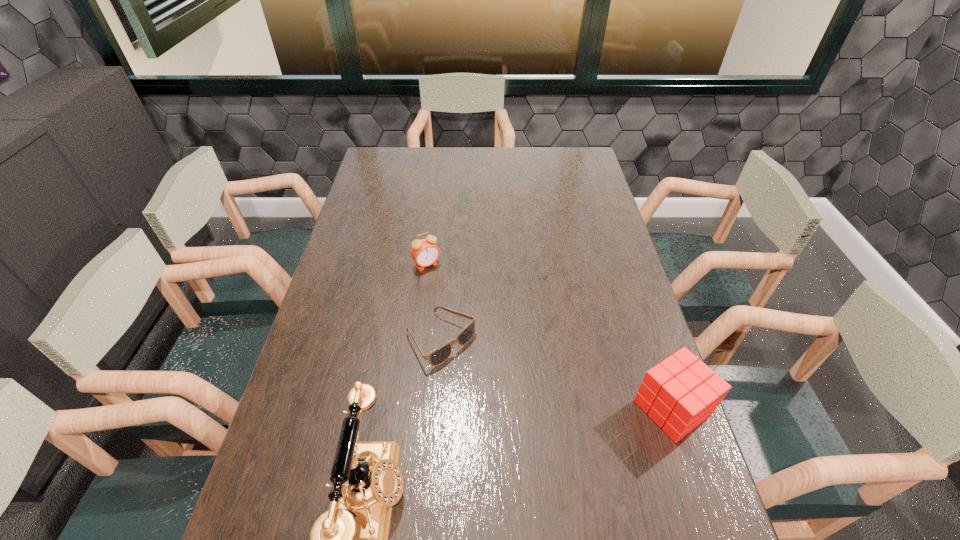
Identify the location of cube. tap(680, 393).

Identify the location of alarm clock. This screenshot has height=540, width=960. (425, 252).

This screenshot has height=540, width=960. In order to click on the third nearest object in this screenshot , I will do `click(440, 355)`.

Where is `sunglasses`? sunglasses is located at coordinates (440, 355).

The height and width of the screenshot is (540, 960). What are the coordinates of `free space located 0.140m on the left of the rightmost object` in the screenshot? It's located at (577, 408).

Where is `vacant area located on the face of the alarm clock`? The height and width of the screenshot is (540, 960). vacant area located on the face of the alarm clock is located at coordinates (496, 363).

Locate an element on the screen. This screenshot has width=960, height=540. vacant space located 0.270m on the face of the alarm clock is located at coordinates (474, 331).

The width and height of the screenshot is (960, 540). What are the coordinates of `vacant area situated on the face of the alarm clock` in the screenshot? It's located at (440, 282).

You are a GUI agent. You are given a task and a screenshot of the screen. Output one action in this format:
    pyautogui.click(x=<x>, y=<y>)
    Task: Click on the free space located on the frames of the second farthest object
    Image resolution: width=960 pixels, height=540 pixels.
    Given the screenshot: What is the action you would take?
    pyautogui.click(x=504, y=394)

Where is `vacant area situated 0.200m on the frames of the second farthest object`? The width and height of the screenshot is (960, 540). vacant area situated 0.200m on the frames of the second farthest object is located at coordinates (523, 409).